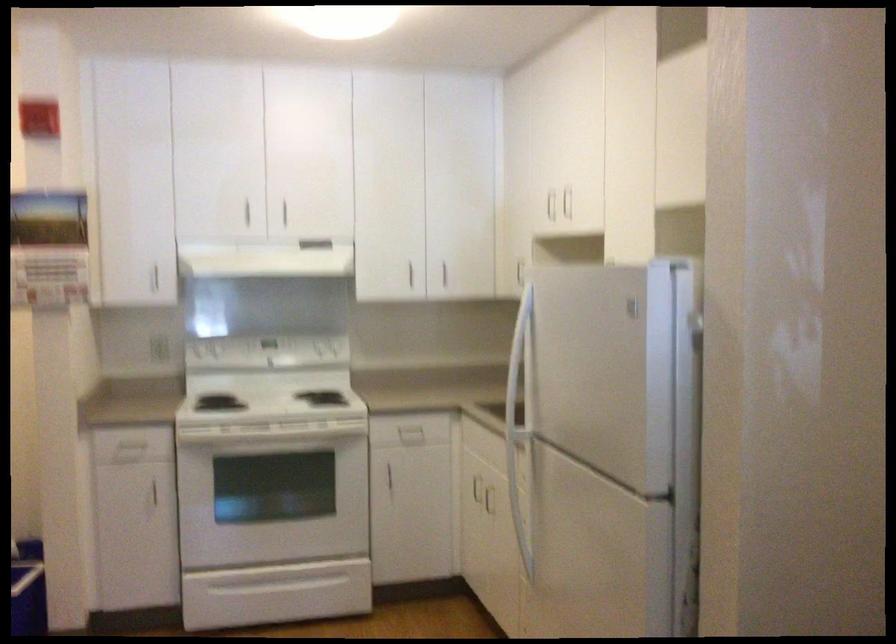
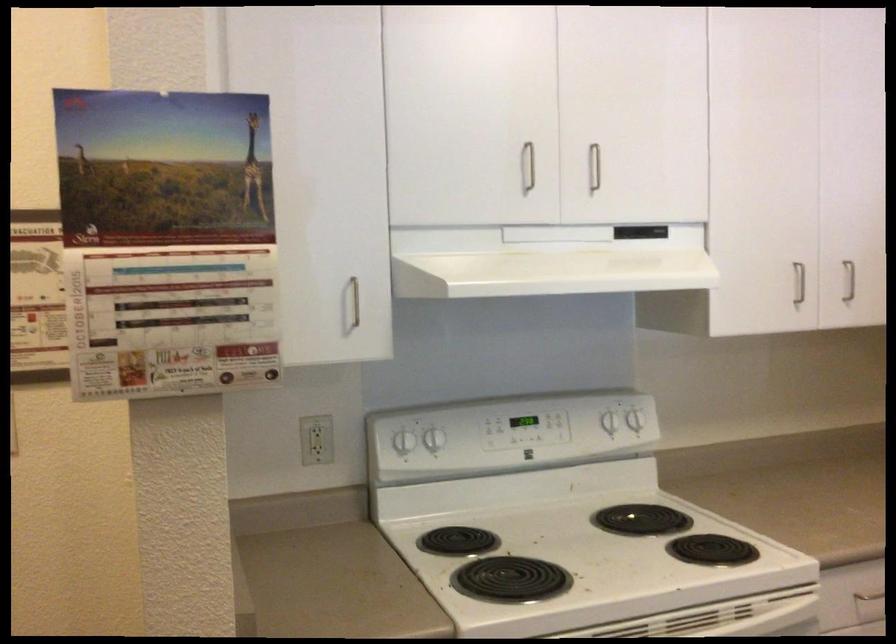
The point at (x=316, y=345) is marked in the first image. Where is the corresponding point in the second image?

(608, 422)